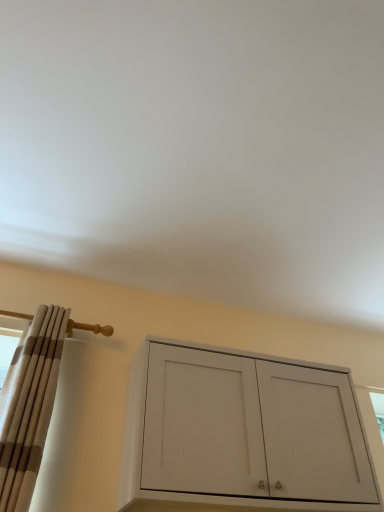
Question: Is white matte cabinet at center located within beige striped curtain at left?

Choices:
 (A) yes
 (B) no

Answer: (B)

Question: Is beige striped curtain at left shorter than white matte cabinet at center?

Choices:
 (A) yes
 (B) no

Answer: (B)

Question: Is beige striped curtain at left to the left of white matte cabinet at center from the viewer's perspective?

Choices:
 (A) no
 (B) yes

Answer: (B)

Question: From the image's perspective, would you say beige striped curtain at left is shown under white matte cabinet at center?

Choices:
 (A) no
 (B) yes

Answer: (A)

Question: Is beige striped curtain at left outside of white matte cabinet at center?

Choices:
 (A) no
 (B) yes

Answer: (B)

Question: Does beige striped curtain at left appear on the right side of white matte cabinet at center?

Choices:
 (A) no
 (B) yes

Answer: (A)

Question: Is white matte cabinet at center bigger than beige striped curtain at left?

Choices:
 (A) yes
 (B) no

Answer: (A)

Question: Are white matte cabinet at center and beige striped curtain at left far apart?

Choices:
 (A) no
 (B) yes

Answer: (A)

Question: Is white matte cabinet at center beside beige striped curtain at left?

Choices:
 (A) no
 (B) yes

Answer: (A)

Question: Is white matte cabinet at center surrounding beige striped curtain at left?

Choices:
 (A) no
 (B) yes

Answer: (A)

Question: From a real-world perspective, is white matte cabinet at center positioned under beige striped curtain at left based on gravity?

Choices:
 (A) no
 (B) yes

Answer: (B)

Question: Can you confirm if white matte cabinet at center is taller than beige striped curtain at left?

Choices:
 (A) yes
 (B) no

Answer: (B)

Question: Is white matte cabinet at center spatially inside beige striped curtain at left, or outside of it?

Choices:
 (A) inside
 (B) outside

Answer: (B)